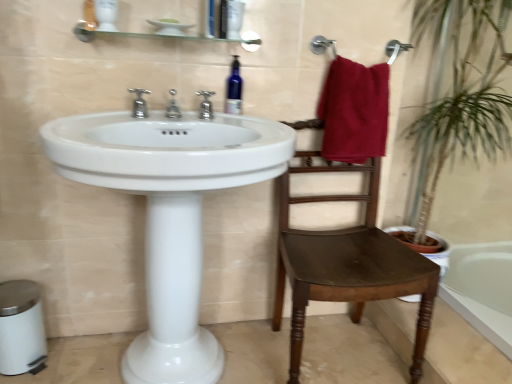
Question: Which direction should I rotate to look at silver metallic faucet at upper center, the 2th tap when ordered from left to right, — up or down?

Choices:
 (A) down
 (B) up

Answer: (B)

Question: Can you confirm if silver metallic faucet at upper center, the 2th tap when ordered from left to right, is positioned to the left of polished chrome faucet at center, the third tap from the right?

Choices:
 (A) no
 (B) yes

Answer: (A)

Question: Are silver metallic faucet at upper center, the 2th tap positioned from the right, and polished chrome faucet at center, the 1th tap in the left-to-right sequence, far apart?

Choices:
 (A) yes
 (B) no

Answer: (B)

Question: Does silver metallic faucet at upper center, the 2th tap positioned from the right, have a larger size compared to polished chrome faucet at center, the third tap from the right?

Choices:
 (A) no
 (B) yes

Answer: (A)

Question: Is polished chrome faucet at center, the third tap from the right, located within silver metallic faucet at upper center, the 2th tap when ordered from left to right?

Choices:
 (A) yes
 (B) no

Answer: (B)

Question: Is the depth of silver metallic faucet at upper center, the 2th tap positioned from the right, greater than that of polished chrome faucet at center, the third tap from the right?

Choices:
 (A) yes
 (B) no

Answer: (B)

Question: Is silver metallic faucet at upper center, the 2th tap positioned from the right, wider than polished chrome faucet at center, the third tap from the right?

Choices:
 (A) no
 (B) yes

Answer: (B)

Question: Is polished chrome faucet at center, the 1th tap in the left-to-right sequence, not within smooth white bathtub at lower right?

Choices:
 (A) yes
 (B) no

Answer: (A)

Question: Does polished chrome faucet at center, the third tap from the right, have a lesser height compared to smooth white bathtub at lower right?

Choices:
 (A) yes
 (B) no

Answer: (B)

Question: Does polished chrome faucet at center, the 1th tap in the left-to-right sequence, lie in front of smooth white bathtub at lower right?

Choices:
 (A) no
 (B) yes

Answer: (B)

Question: Can you confirm if polished chrome faucet at center, the 1th tap in the left-to-right sequence, is bigger than smooth white bathtub at lower right?

Choices:
 (A) yes
 (B) no

Answer: (B)

Question: From the image's perspective, would you say polished chrome faucet at center, the third tap from the right, is positioned over smooth white bathtub at lower right?

Choices:
 (A) no
 (B) yes

Answer: (B)

Question: Is polished chrome faucet at center, the 1th tap in the left-to-right sequence, far away from smooth white bathtub at lower right?

Choices:
 (A) no
 (B) yes

Answer: (B)

Question: Is maroon fabric towel at upper right next to white glossy sink at center?

Choices:
 (A) no
 (B) yes

Answer: (A)